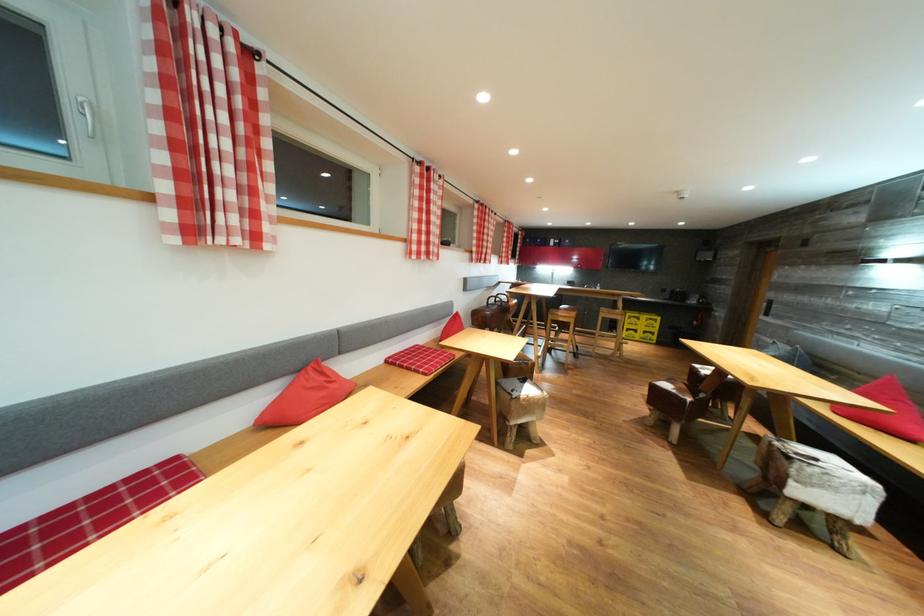
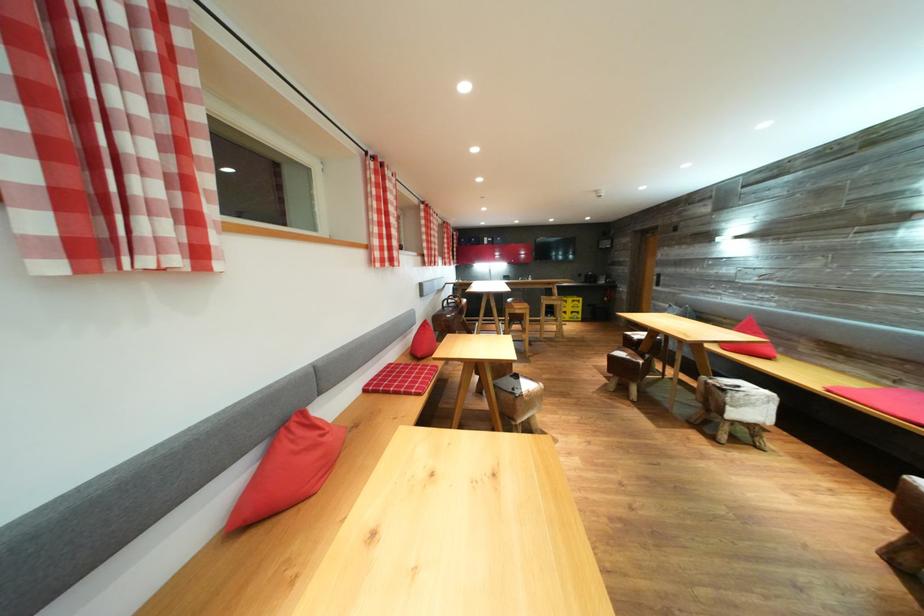
Find the pixel in the second image that matches pixel 650 323 in the first image.

(577, 305)